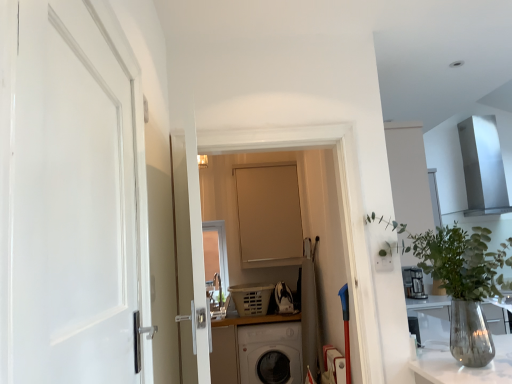
Question: Can you confirm if clear glass vase at right is taller than matte beige door at center, the first door viewed from the right?

Choices:
 (A) yes
 (B) no

Answer: (B)

Question: Is clear glass vase at right smaller than matte beige door at center, arranged as the first door when viewed from the back?

Choices:
 (A) yes
 (B) no

Answer: (B)

Question: Is clear glass vase at right thinner than matte beige door at center, the first door viewed from the right?

Choices:
 (A) yes
 (B) no

Answer: (B)

Question: Is clear glass vase at right not within matte beige door at center, arranged as the first door when viewed from the back?

Choices:
 (A) yes
 (B) no

Answer: (A)

Question: Can you confirm if clear glass vase at right is shorter than matte beige door at center, the first door viewed from the right?

Choices:
 (A) no
 (B) yes

Answer: (B)

Question: Choose the correct answer: Is white matte door at left, the 1th door when ordered from front to back, inside clear glass vase at right or outside it?

Choices:
 (A) inside
 (B) outside

Answer: (B)

Question: Considering the positions of white matte door at left, the second door positioned from the right, and clear glass vase at right in the image, is white matte door at left, the second door positioned from the right, wider or thinner than clear glass vase at right?

Choices:
 (A) wide
 (B) thin

Answer: (B)

Question: From their relative heights in the image, would you say white matte door at left, which is the second door from back to front, is taller or shorter than clear glass vase at right?

Choices:
 (A) short
 (B) tall

Answer: (B)

Question: Would you say white matte door at left, the second door positioned from the right, is to the left or to the right of clear glass vase at right in the picture?

Choices:
 (A) left
 (B) right

Answer: (A)

Question: Would you say matte beige door at center, the 2th door in the front-to-back sequence, is to the left or to the right of white matte door at left, which is the second door from back to front, in the picture?

Choices:
 (A) right
 (B) left

Answer: (A)

Question: Do you think matte beige door at center, the 2th door in the front-to-back sequence, is within white matte door at left, the 1th door when ordered from front to back, or outside of it?

Choices:
 (A) inside
 (B) outside

Answer: (B)

Question: Considering the positions of matte beige door at center, arranged as the first door when viewed from the back, and white matte door at left, the 1th door when ordered from front to back, in the image, is matte beige door at center, arranged as the first door when viewed from the back, wider or thinner than white matte door at left, the 1th door when ordered from front to back,?

Choices:
 (A) thin
 (B) wide

Answer: (A)

Question: In terms of size, does matte beige door at center, the first door viewed from the right, appear bigger or smaller than white matte door at left, the 1th door when ordered from front to back?

Choices:
 (A) big
 (B) small

Answer: (B)

Question: Based on their positions, is clear glass vase at right located to the left or right of matte beige door at center, the second door when ordered from left to right?

Choices:
 (A) left
 (B) right

Answer: (B)

Question: Considering the positions of point (394, 226) and point (252, 220), is point (394, 226) closer or farther from the camera than point (252, 220)?

Choices:
 (A) farther
 (B) closer

Answer: (B)